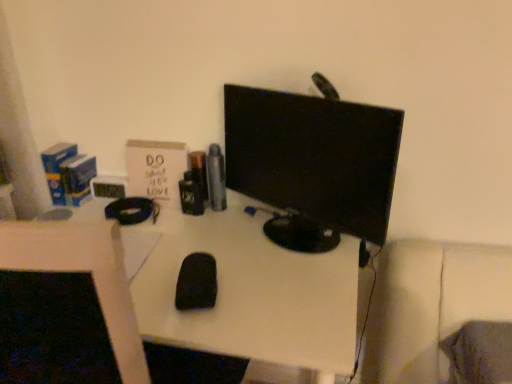
Question: Can you confirm if black glossy monitor at center is bigger than black matte mouse at center?

Choices:
 (A) yes
 (B) no

Answer: (A)

Question: Considering the relative positions of black glossy monitor at center and black matte mouse at center in the image provided, is black glossy monitor at center in front of black matte mouse at center?

Choices:
 (A) no
 (B) yes

Answer: (B)

Question: Does black glossy monitor at center contain black matte mouse at center?

Choices:
 (A) no
 (B) yes

Answer: (A)

Question: Can you confirm if black glossy monitor at center is positioned to the left of black matte mouse at center?

Choices:
 (A) yes
 (B) no

Answer: (B)

Question: From the image's perspective, is black glossy monitor at center above black matte mouse at center?

Choices:
 (A) no
 (B) yes

Answer: (B)

Question: Is black glossy monitor at center positioned beyond the bounds of black matte mouse at center?

Choices:
 (A) no
 (B) yes

Answer: (B)

Question: From a real-world perspective, is black matte mouse at center under black matte mouse at center?

Choices:
 (A) no
 (B) yes

Answer: (A)

Question: Is black matte mouse at center outside black matte mouse at center?

Choices:
 (A) no
 (B) yes

Answer: (B)

Question: Considering the relative sizes of black matte mouse at center and black matte mouse at center in the image provided, is black matte mouse at center shorter than black matte mouse at center?

Choices:
 (A) yes
 (B) no

Answer: (A)

Question: Is black matte mouse at center turned away from black matte mouse at center?

Choices:
 (A) no
 (B) yes

Answer: (A)

Question: From the image's perspective, would you say black matte mouse at center is shown under black matte mouse at center?

Choices:
 (A) no
 (B) yes

Answer: (A)

Question: Considering the relative sizes of black matte mouse at center and black matte mouse at center in the image provided, is black matte mouse at center wider than black matte mouse at center?

Choices:
 (A) no
 (B) yes

Answer: (A)

Question: Can you confirm if black matte mouse at center is bigger than black matte mouse at center?

Choices:
 (A) yes
 (B) no

Answer: (A)